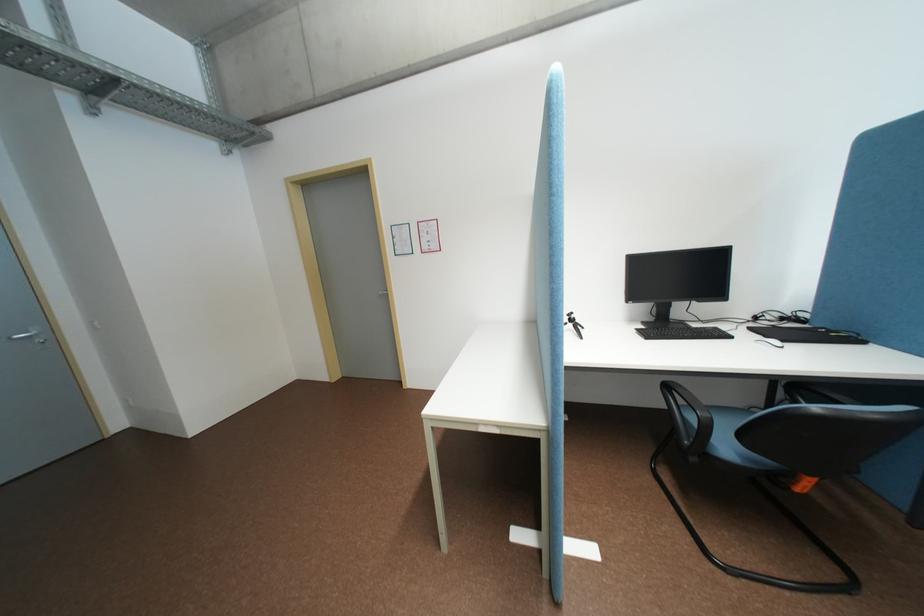
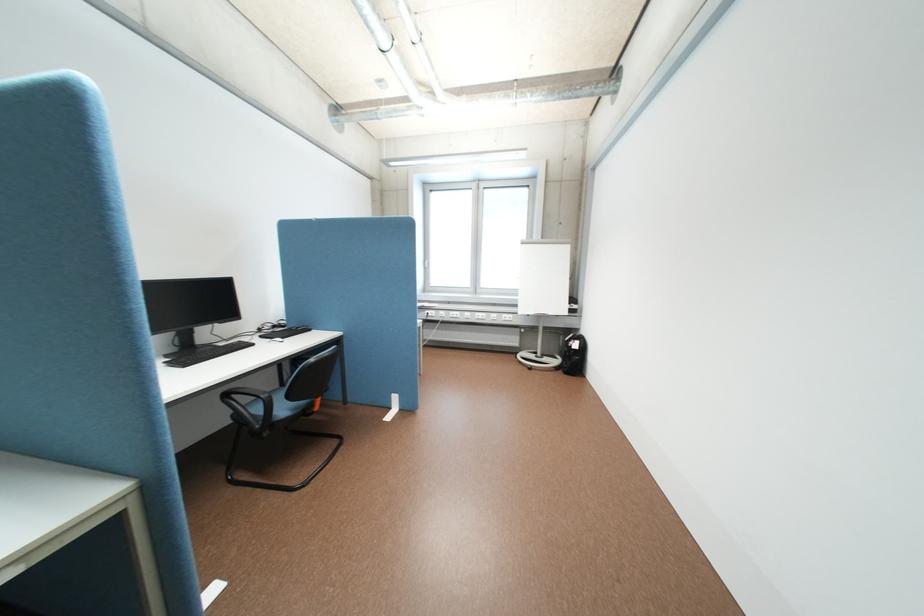
Question: The camera is either moving clockwise (left) or counter-clockwise (right) around the object. The first image is from the beginning of the video and the second image is from the end. Is the camera moving left or right when shooting the video?

Choices:
 (A) Left
 (B) Right

Answer: (A)